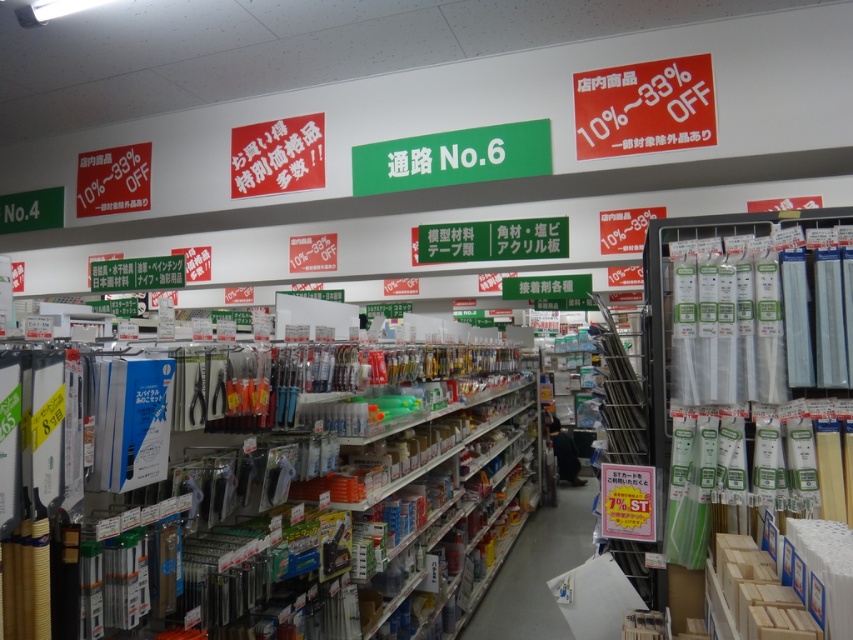
Question: Which point is closer to the camera?

Choices:
 (A) (791, 288)
 (B) (589, 104)

Answer: (A)

Question: Observing the image, what is the correct spatial positioning of clear plastic tubes at right in reference to white paper sign at upper right?

Choices:
 (A) left
 (B) right

Answer: (A)

Question: Does clear plastic tubes at right appear on the left side of white paper sign at upper right?

Choices:
 (A) yes
 (B) no

Answer: (A)

Question: In this image, where is clear plastic tubes at right located relative to white paper sign at upper right?

Choices:
 (A) below
 (B) above

Answer: (A)